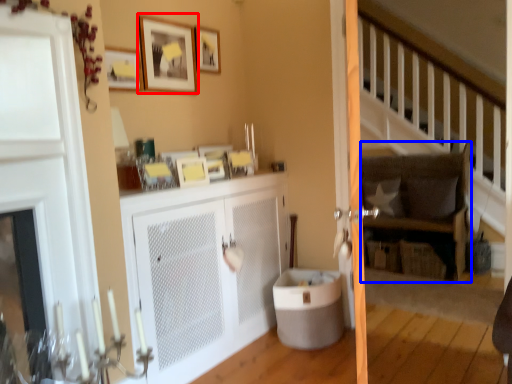
Question: Which of the following is the farthest to the observer, picture frame (highlighted by a red box) or rocking chair (highlighted by a blue box)?

Choices:
 (A) picture frame
 (B) rocking chair

Answer: (B)